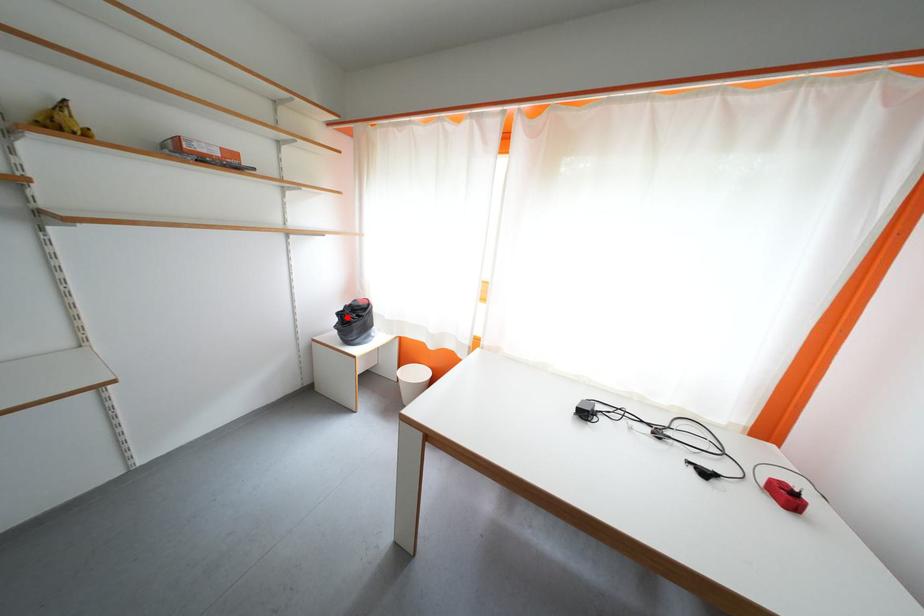
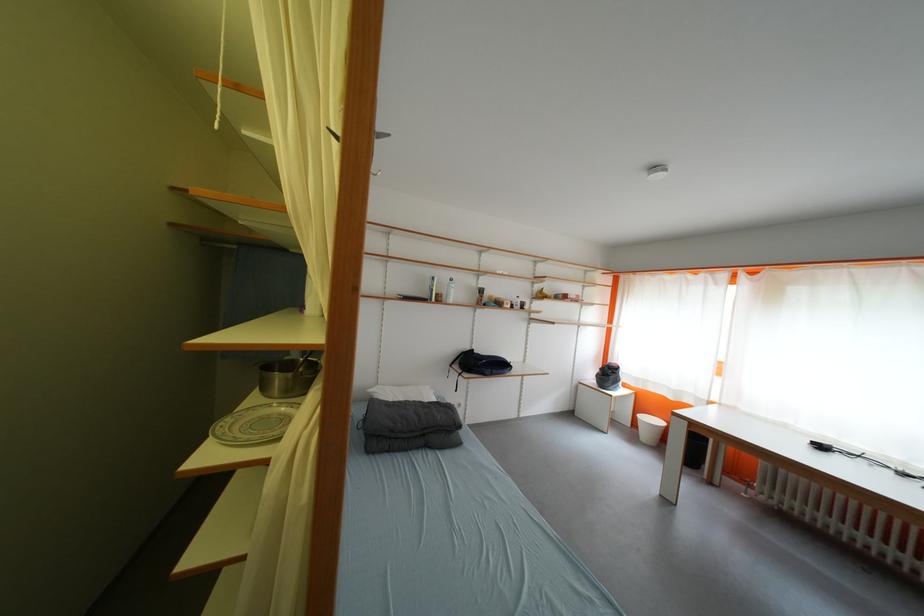
Locate, in the second image, the point that corresponds to the highlighted location in the first image.

(610, 371)